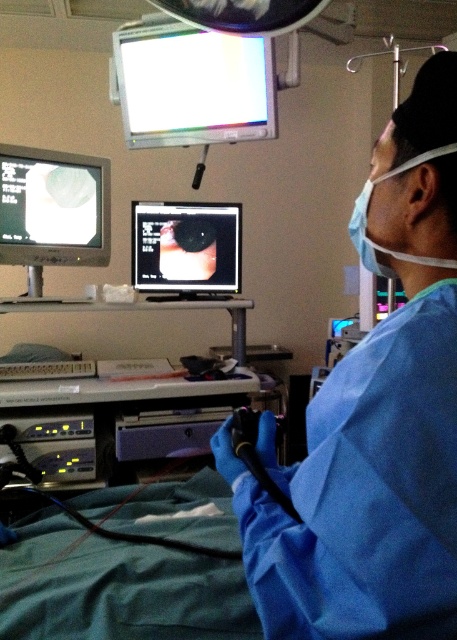
Which of these two, white glossy monitor at upper center or matte black monitor at center, stands taller?

Standing taller between the two is white glossy monitor at upper center.

Where is `white glossy monitor at upper center`? white glossy monitor at upper center is located at coordinates (191, 84).

Consider the image. Is white glossy monitor at upper center below matte black monitor at upper left?

No, white glossy monitor at upper center is not below matte black monitor at upper left.

Who is taller, white glossy monitor at upper center or matte black monitor at upper left?

white glossy monitor at upper center is taller.

Measure the distance between point (262, 68) and camera.

Point (262, 68) is 7.17 feet from camera.

Where is `white glossy monitor at upper center`? white glossy monitor at upper center is located at coordinates (191, 84).

Does point (327, 461) come behind point (185, 132)?

No, it is in front of (185, 132).

Who is higher up, blue surgical gown at center or white glossy monitor at upper center?

white glossy monitor at upper center is higher up.

Locate an element on the screen. This screenshot has width=457, height=640. blue surgical gown at center is located at coordinates coord(375,417).

Locate an element on the screen. The height and width of the screenshot is (640, 457). blue surgical gown at center is located at coordinates (375, 417).